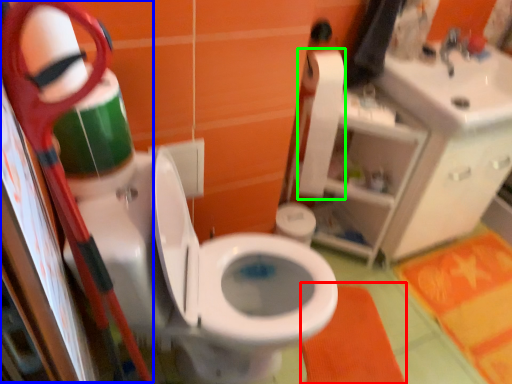
Question: Which object is positioned closest to bath mat (highlighted by a red box)? Select from scissors (highlighted by a blue box) and toilet paper (highlighted by a green box).

Choices:
 (A) scissors
 (B) toilet paper

Answer: (B)